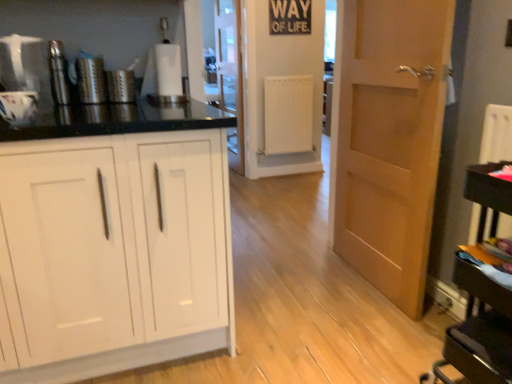
Looking at this image, in order to face metallic grater at left, arranged as the fourth appliance when viewed from the front, should I rotate leftwards or rightwards?

It's best to rotate left around 17.543 degrees.

Where is `metallic silver thermos at left, which appears as the second appliance when viewed from the front`? The height and width of the screenshot is (384, 512). metallic silver thermos at left, which appears as the second appliance when viewed from the front is located at coordinates (59, 73).

Describe the element at coordinates (18, 106) in the screenshot. The width and height of the screenshot is (512, 384). I see `white glossy mug at upper left, the first appliance from the front` at that location.

The image size is (512, 384). Describe the element at coordinates (230, 74) in the screenshot. I see `clear glass screen door at center` at that location.

In order to click on brushed metal grater at left, the second appliance viewed from the back in this screenshot , I will do [x=90, y=78].

What do you see at coordinates (90, 78) in the screenshot?
I see `brushed metal grater at left, arranged as the third appliance when viewed from the front` at bounding box center [90, 78].

Find the location of `black plastic table at right`. black plastic table at right is located at coordinates coord(478,331).

What's the angular difference between clear glass screen door at center and white matte cabinet at left's facing directions?

They differ by 87.6 degrees in their facing directions.

In the image, is clear glass screen door at center on the left side or the right side of white matte cabinet at left?

In the image, clear glass screen door at center appears on the right side of white matte cabinet at left.

Relative to white matte cabinet at left, is clear glass screen door at center in front or behind?

clear glass screen door at center is behind white matte cabinet at left.

Based on the photo, from the image's perspective, is clear glass screen door at center located above or below white matte cabinet at left?

Based on their image positions, clear glass screen door at center is located above white matte cabinet at left.

Which object is positioned more to the left, white glossy mug at upper left, the first appliance from the front, or black plastic table at right?

Positioned to the left is white glossy mug at upper left, the first appliance from the front.

Which object is thinner, white glossy mug at upper left, the first appliance from the front, or black plastic table at right?

white glossy mug at upper left, the first appliance from the front.

Where is `table in front of the white glossy mug at upper left, the 4th appliance in the back-to-front sequence`? Image resolution: width=512 pixels, height=384 pixels. table in front of the white glossy mug at upper left, the 4th appliance in the back-to-front sequence is located at coordinates (478, 331).

Are white glossy mug at upper left, the 4th appliance in the back-to-front sequence, and black plastic table at right beside each other?

No, white glossy mug at upper left, the 4th appliance in the back-to-front sequence, is not next to black plastic table at right.

From the image's perspective, which is above, brushed metal grater at left, arranged as the third appliance when viewed from the front, or white matte cabinet at left?

brushed metal grater at left, arranged as the third appliance when viewed from the front.

Is brushed metal grater at left, the second appliance viewed from the back, at the left side of white matte cabinet at left?

Correct, you'll find brushed metal grater at left, the second appliance viewed from the back, to the left of white matte cabinet at left.

Which of these two, brushed metal grater at left, arranged as the third appliance when viewed from the front, or white matte cabinet at left, is smaller?

brushed metal grater at left, arranged as the third appliance when viewed from the front.

Based on their sizes in the image, would you say metallic grater at left, marked as the 1th appliance in a back-to-front arrangement, is bigger or smaller than clear glass screen door at center?

metallic grater at left, marked as the 1th appliance in a back-to-front arrangement, is smaller than clear glass screen door at center.

Is metallic grater at left, marked as the 1th appliance in a back-to-front arrangement, directly adjacent to clear glass screen door at center?

They are not placed beside each other.

Is metallic grater at left, arranged as the fourth appliance when viewed from the front, not within clear glass screen door at center?

Yes.

Which point is more forward, (x=130, y=70) or (x=229, y=0)?

Positioned in front is point (x=130, y=70).

From a real-world perspective, is clear glass screen door at center positioned under white glossy mug at upper left, the first appliance from the front, based on gravity?

Yes, from a real-world perspective, clear glass screen door at center is beneath white glossy mug at upper left, the first appliance from the front.

Which is correct: clear glass screen door at center is inside white glossy mug at upper left, the 4th appliance in the back-to-front sequence, or outside of it?

clear glass screen door at center lies outside white glossy mug at upper left, the 4th appliance in the back-to-front sequence.

Is clear glass screen door at center facing towards white glossy mug at upper left, the 4th appliance in the back-to-front sequence?

No.

Measure the distance from clear glass screen door at center to white glossy mug at upper left, the first appliance from the front.

clear glass screen door at center is 3.13 meters from white glossy mug at upper left, the first appliance from the front.

Can you confirm if light brown wood door at right is positioned to the left of brushed metal grater at left, the second appliance viewed from the back?

No, light brown wood door at right is not to the left of brushed metal grater at left, the second appliance viewed from the back.

Considering the points (443, 72) and (83, 61), which point is behind, point (443, 72) or point (83, 61)?

Point (83, 61)

Is light brown wood door at right thinner than brushed metal grater at left, the second appliance viewed from the back?

Incorrect, the width of light brown wood door at right is not less than that of brushed metal grater at left, the second appliance viewed from the back.

Considering the relative sizes of light brown wood door at right and brushed metal grater at left, arranged as the third appliance when viewed from the front, in the image provided, is light brown wood door at right smaller than brushed metal grater at left, arranged as the third appliance when viewed from the front,?

No.

Measure the distance between white matte radiator at center and metallic grater at left, marked as the 1th appliance in a back-to-front arrangement.

white matte radiator at center and metallic grater at left, marked as the 1th appliance in a back-to-front arrangement, are 2.34 meters apart.

Is point (298, 82) behind point (129, 77)?

Yes, it is.

Is white matte radiator at center next to metallic grater at left, marked as the 1th appliance in a back-to-front arrangement?

No, white matte radiator at center is not with metallic grater at left, marked as the 1th appliance in a back-to-front arrangement.

Could you tell me if white matte radiator at center is facing metallic grater at left, marked as the 1th appliance in a back-to-front arrangement?

No, white matte radiator at center is not facing towards metallic grater at left, marked as the 1th appliance in a back-to-front arrangement.

Image resolution: width=512 pixels, height=384 pixels. Identify the location of cabinetry that appears below the clear glass screen door at center (from the image's perspective). (113, 253).

Which appliance is the 3rd one when counting from the left side of the black plastic table at right? Please provide its 2D coordinates.

[(18, 106)]

Which object lies further to the anchor point white matte cabinet at left, clear glass screen door at center or white matte radiator at center?

Based on the image, clear glass screen door at center appears to be further to white matte cabinet at left.

From the image, which object appears to be nearer to white glossy mug at upper left, the 4th appliance in the back-to-front sequence, clear glass screen door at center or white matte cabinet at left?

white matte cabinet at left lies closer to white glossy mug at upper left, the 4th appliance in the back-to-front sequence, than the other object.

Estimate the real-world distances between objects in this image. Which object is further from white matte cabinet at left, brushed metal grater at left, arranged as the third appliance when viewed from the front, or clear glass screen door at center?

clear glass screen door at center is positioned further to the anchor white matte cabinet at left.

Which object lies further to the anchor point black plastic table at right, clear glass screen door at center or white matte cabinet at left?

The object further to black plastic table at right is clear glass screen door at center.

Estimate the real-world distances between objects in this image. Which object is further from clear glass screen door at center, light brown wood door at right or metallic silver thermos at left, the third appliance positioned from the back?

Based on the image, metallic silver thermos at left, the third appliance positioned from the back, appears to be further to clear glass screen door at center.

Which object lies further to the anchor point metallic silver thermos at left, which appears as the second appliance when viewed from the front, black plastic table at right or clear glass screen door at center?

The object further to metallic silver thermos at left, which appears as the second appliance when viewed from the front, is clear glass screen door at center.

Consider the image. From the image, which object appears to be nearer to white matte cabinet at left, metallic silver thermos at left, the third appliance positioned from the back, or white glossy mug at upper left, the 4th appliance in the back-to-front sequence?

Based on the image, white glossy mug at upper left, the 4th appliance in the back-to-front sequence, appears to be nearer to white matte cabinet at left.

Based on their spatial positions, is black plastic table at right or light brown wood door at right further from metallic silver thermos at left, the third appliance positioned from the back?

black plastic table at right is further to metallic silver thermos at left, the third appliance positioned from the back.

This screenshot has height=384, width=512. I want to click on screen door between brushed metal grater at left, the second appliance viewed from the back, and white matte radiator at center from front to back, so click(230, 74).

You are a GUI agent. You are given a task and a screenshot of the screen. Output one action in this format:
    pyautogui.click(x=<x>, y=<y>)
    Task: Click on the door between white glossy mug at upper left, the 4th appliance in the back-to-front sequence, and clear glass screen door at center, along the z-axis
    The image size is (512, 384).
    Given the screenshot: What is the action you would take?
    pyautogui.click(x=389, y=139)

Locate an element on the screen. appliance between white matte cabinet at left and black plastic table at right in the horizontal direction is located at coordinates (121, 86).

The width and height of the screenshot is (512, 384). I want to click on door between white matte cabinet at left and white matte radiator at center in the front-back direction, so click(389, 139).